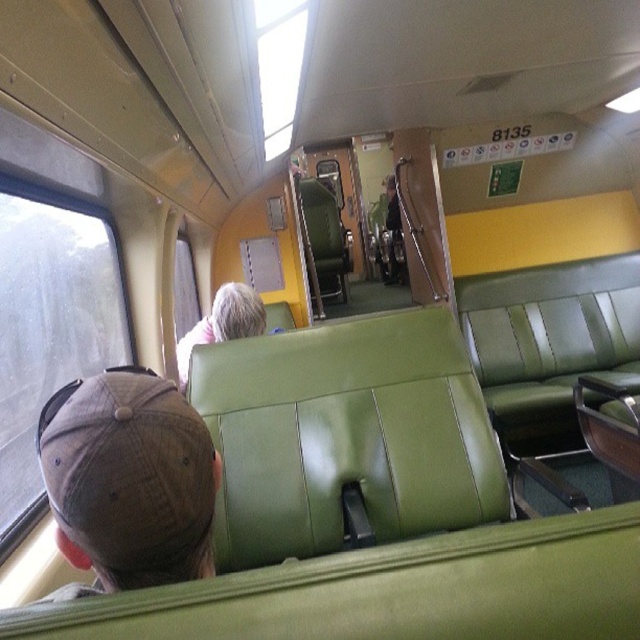
Consider the image. You are sitting in the train carriage and want to look outside. Where is the transparent glass window at upper center located relative to your seat?

The transparent glass window at upper center is located at point (278, 67) relative to your seat.

You are a passenger sitting in the train carriage and want to check the weather outside. You have to decide whether to look through the transparent glass window at upper center or the gray matte hair at center. Which object allows you to see outside?

The transparent glass window at upper center allows you to see outside because it is a window, while the gray matte hair at center is part of a person and does not provide a view.

You are a passenger seated in the train carriage and want to look outside through the transparent glass window at upper center. Your seat is 5 feet away from the window. Can you reach the window within your seat without moving your chair?

The transparent glass window at upper center is 4.70 feet away from the passenger, so no, the passenger cannot reach the window within their seat without moving their chair since it is farther than the 5 feet distance mentioned.